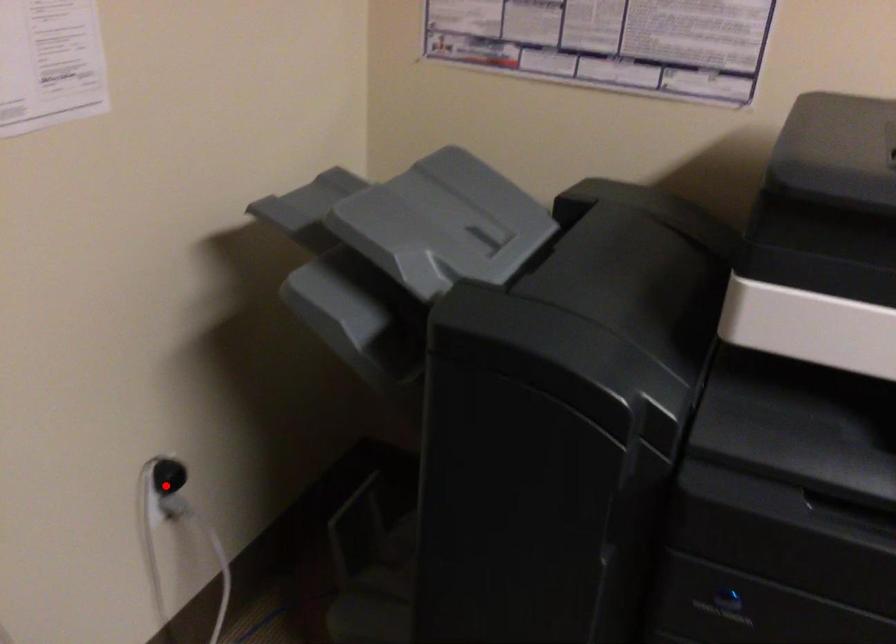
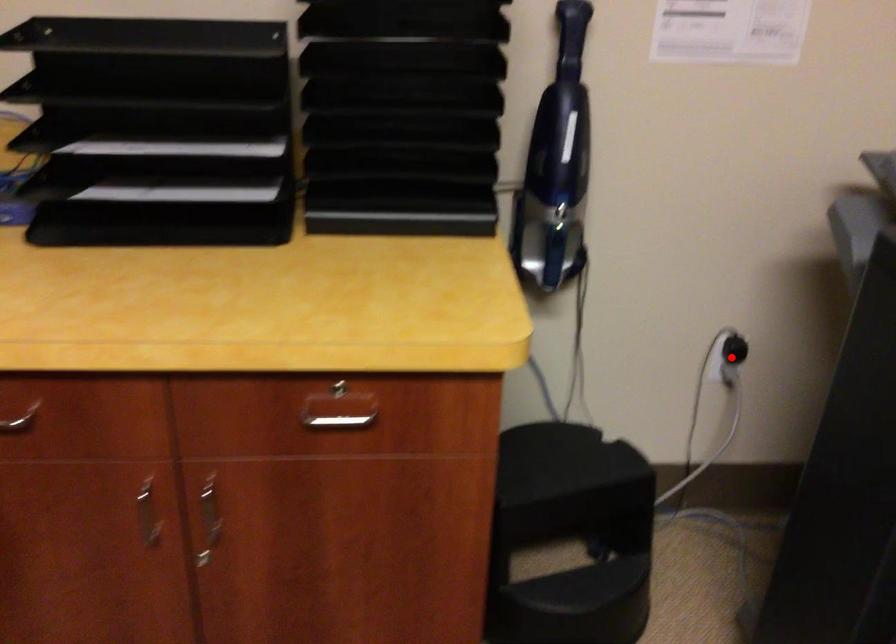
I am providing you with two images of the same scene from different viewpoints. A red point is marked on the first image and another point is marked on the second image. Do the highlighted points in image1 and image2 indicate the same real-world spot?

Yes